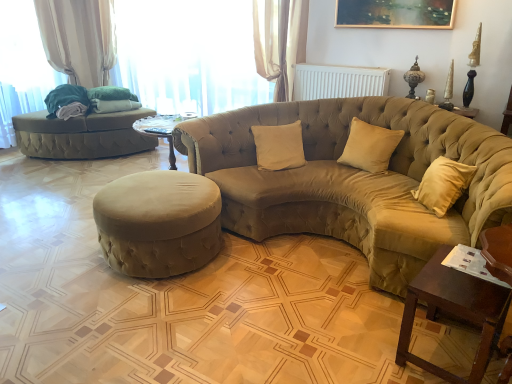
Question: Considering the relative positions of suede-like beige studio couch at left, the 1th studio couch when ordered from left to right, and suede ottoman at center in the image provided, is suede-like beige studio couch at left, the 1th studio couch when ordered from left to right, to the left of suede ottoman at center from the viewer's perspective?

Choices:
 (A) no
 (B) yes

Answer: (B)

Question: Is suede-like beige studio couch at left, which is the second studio couch in front-to-back order, at the right side of suede ottoman at center?

Choices:
 (A) no
 (B) yes

Answer: (A)

Question: Is suede-like beige studio couch at left, positioned as the 1th studio couch in back-to-front order, wider than suede ottoman at center?

Choices:
 (A) no
 (B) yes

Answer: (B)

Question: Does suede-like beige studio couch at left, the 1th studio couch when ordered from left to right, have a lesser width compared to suede ottoman at center?

Choices:
 (A) yes
 (B) no

Answer: (B)

Question: From a real-world perspective, is suede-like beige studio couch at left, marked as the 2th studio couch in a right-to-left arrangement, on top of suede ottoman at center?

Choices:
 (A) no
 (B) yes

Answer: (B)

Question: Is suede-like beige studio couch at left, marked as the 2th studio couch in a right-to-left arrangement, not inside suede ottoman at center?

Choices:
 (A) yes
 (B) no

Answer: (A)

Question: Can you confirm if sheer fabric curtain at upper center is positioned to the right of velvet beige studio couch at center, which is the 2th studio couch in back-to-front order?

Choices:
 (A) no
 (B) yes

Answer: (A)

Question: Could you tell me if sheer fabric curtain at upper center is turned towards velvet beige studio couch at center, which is the 1th studio couch in front-to-back order?

Choices:
 (A) yes
 (B) no

Answer: (B)

Question: Is sheer fabric curtain at upper center further to camera compared to velvet beige studio couch at center, marked as the first studio couch in a right-to-left arrangement?

Choices:
 (A) no
 (B) yes

Answer: (B)

Question: Does sheer fabric curtain at upper center have a greater width compared to velvet beige studio couch at center, which is the 1th studio couch in front-to-back order?

Choices:
 (A) no
 (B) yes

Answer: (A)

Question: Is sheer fabric curtain at upper center beside velvet beige studio couch at center, which is the 1th studio couch in front-to-back order?

Choices:
 (A) yes
 (B) no

Answer: (B)

Question: Is sheer fabric curtain at upper center taller than velvet beige studio couch at center, which is the 2th studio couch in back-to-front order?

Choices:
 (A) no
 (B) yes

Answer: (B)

Question: Does suede beige pillow at center, placed as the 1th pillow when sorted from right to left, have a lesser width compared to velvet beige studio couch at center, which is the 1th studio couch in front-to-back order?

Choices:
 (A) no
 (B) yes

Answer: (B)